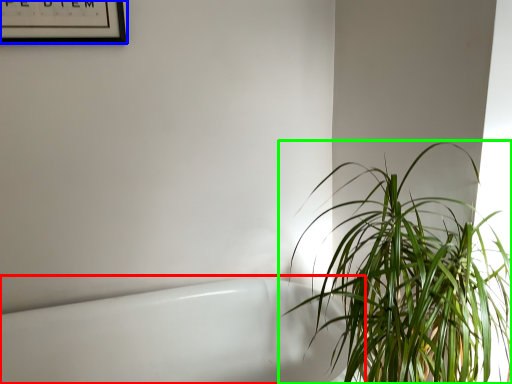
Question: Estimate the real-world distances between objects in this image. Which object is closer to bath (highlighted by a red box), picture frame (highlighted by a blue box) or houseplant (highlighted by a green box)?

Choices:
 (A) picture frame
 (B) houseplant

Answer: (B)